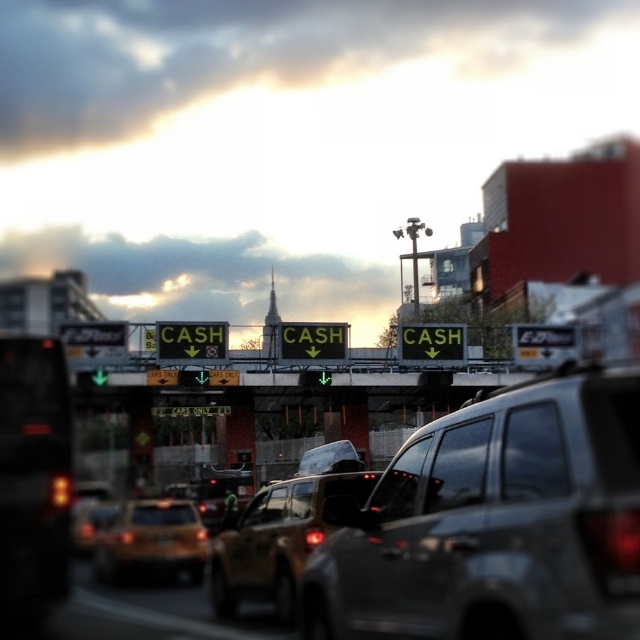
You are a driver approaching the toll booth and see two SUVs ahead. The metallic gray suv at center and the matte gold suv at center. Which SUV is positioned to the right side of the other?

The metallic gray suv at center is to the right of matte gold suv at center.